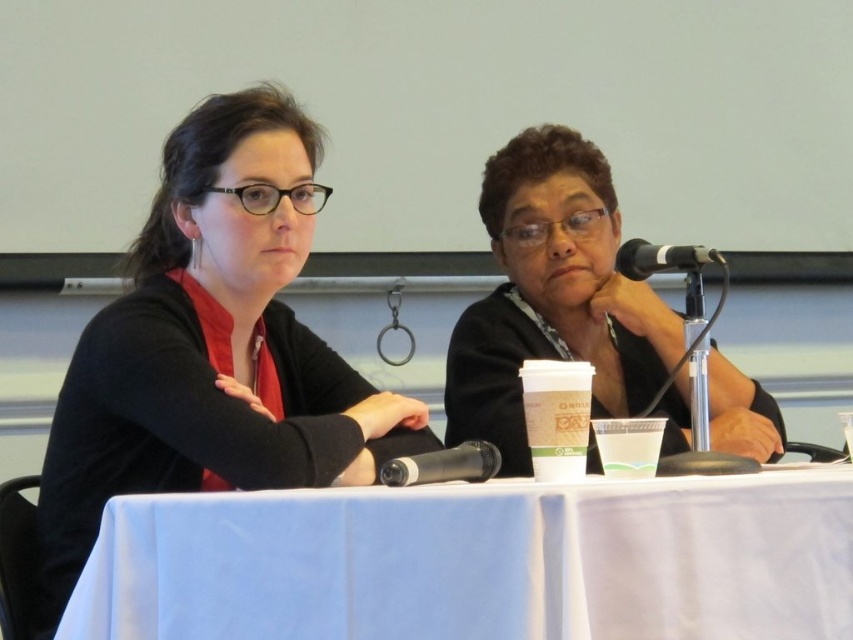
Between blue fabric table at center and black matte microphone at center, which one appears on the right side from the viewer's perspective?

Positioned to the right is black matte microphone at center.

Is blue fabric table at center to the right of black matte microphone at center from the viewer's perspective?

In fact, blue fabric table at center is to the left of black matte microphone at center.

This screenshot has height=640, width=853. Describe the element at coordinates (479, 563) in the screenshot. I see `blue fabric table at center` at that location.

You are a GUI agent. You are given a task and a screenshot of the screen. Output one action in this format:
    pyautogui.click(x=<x>, y=<y>)
    Task: Click on the blue fabric table at center
    The image size is (853, 640).
    Given the screenshot: What is the action you would take?
    pyautogui.click(x=479, y=563)

Looking at this image, between blue fabric table at center and matte black shirt at center, which one is positioned higher?

matte black shirt at center is above.

Is point (97, 573) positioned after point (456, 348)?

No, (97, 573) is closer to viewer.

What are the coordinates of `blue fabric table at center` in the screenshot? It's located at (479, 563).

Does blue fabric table at center have a lesser height compared to black plastic microphone at upper right?

No.

Describe the element at coordinates (479, 563) in the screenshot. I see `blue fabric table at center` at that location.

Find the location of a particular element. blue fabric table at center is located at coordinates (479, 563).